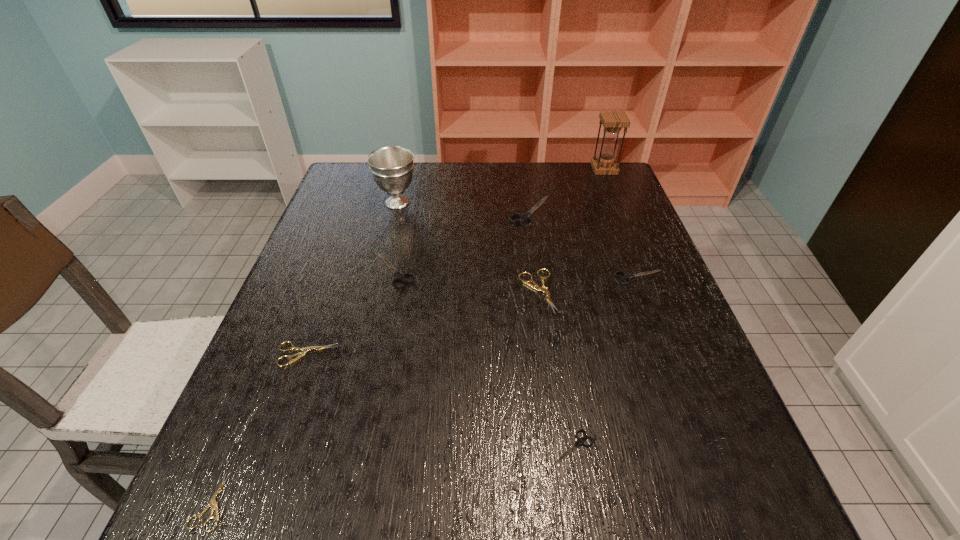
This screenshot has width=960, height=540. In order to click on chalice positioned at the left edge in this screenshot , I will do `click(392, 167)`.

Find the location of a particular element. hourglass situated at the right edge is located at coordinates (613, 121).

Where is `shears that is at the right edge`? This screenshot has height=540, width=960. shears that is at the right edge is located at coordinates (626, 276).

Where is `object located in the far left corner section of the desktop`? This screenshot has height=540, width=960. object located in the far left corner section of the desktop is located at coordinates (392, 167).

Locate an element on the screen. object at the near left corner is located at coordinates (212, 502).

Find the location of `object that is at the far right corner`. object that is at the far right corner is located at coordinates (613, 121).

At what (x,y) coordinates should I click in order to perform the action: click on blank space at the far edge. Please return your answer as a coordinate pair (x, y). The height and width of the screenshot is (540, 960). Looking at the image, I should click on (420, 164).

At what (x,y) coordinates should I click in order to perform the action: click on free point at the near edge. Please return your answer as a coordinate pair (x, y). Looking at the image, I should click on (371, 527).

Locate an element on the screen. Image resolution: width=960 pixels, height=540 pixels. vacant region at the left edge of the desktop is located at coordinates (364, 237).

This screenshot has height=540, width=960. In order to click on vacant space at the right edge of the desktop in this screenshot , I will do `click(673, 325)`.